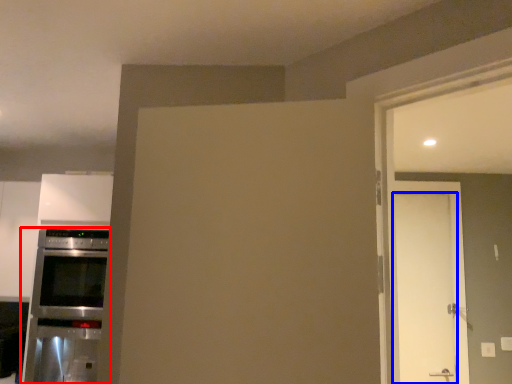
Question: Which object is further to the camera taking this photo, home appliance (highlighted by a red box) or door (highlighted by a blue box)?

Choices:
 (A) home appliance
 (B) door

Answer: (B)